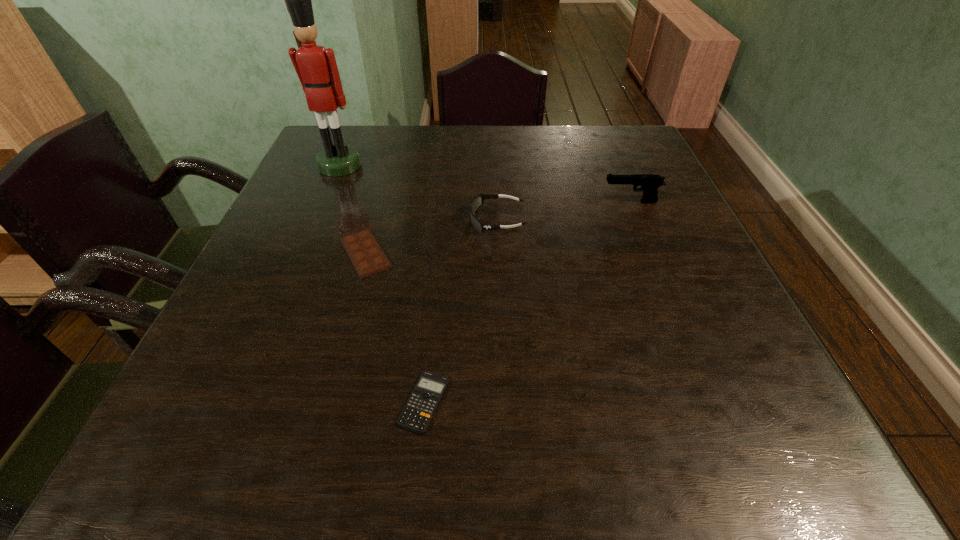
At what (x,y) coordinates should I click in order to perform the action: click on vacant space in between the farthest object and the chocolate bar. Please return your answer as a coordinate pair (x, y). Image resolution: width=960 pixels, height=540 pixels. Looking at the image, I should click on (352, 210).

This screenshot has width=960, height=540. Find the location of `free space between the fourth object from left to right and the fourth object from right to left`. free space between the fourth object from left to right and the fourth object from right to left is located at coordinates (431, 237).

You are a GUI agent. You are given a task and a screenshot of the screen. Output one action in this format:
    pyautogui.click(x=<x>, y=<y>)
    Task: Click on the free area in between the third shortest object and the chocolate bar
    The height and width of the screenshot is (540, 960).
    Given the screenshot: What is the action you would take?
    pyautogui.click(x=431, y=237)

Locate an element on the screen. This screenshot has height=540, width=960. unoccupied position between the chocolate bar and the tallest object is located at coordinates (352, 210).

At what (x,y) coordinates should I click in order to perform the action: click on free space between the farthest object and the second object from right to left. Please return your answer as a coordinate pair (x, y). Looking at the image, I should click on (419, 193).

The image size is (960, 540). In order to click on free space that is in between the goggles and the calculator in this screenshot , I will do `click(460, 311)`.

Identify the location of free point between the pistol and the leftmost object. (486, 184).

Select which object is the fourth closest to the third object from right to left. Please provide its 2D coordinates. Your answer should be formatted as a tuple, i.e. [(x, y)], where the tuple contains the x and y coordinates of a point satisfying the conditions above.

[(316, 67)]

Point out which object is positioned as the third nearest to the rightmost object. Please provide its 2D coordinates. Your answer should be formatted as a tuple, i.e. [(x, y)], where the tuple contains the x and y coordinates of a point satisfying the conditions above.

[(418, 411)]

At what (x,y) coordinates should I click in order to perform the action: click on vacant space that satisfies the following two spatial constraints: 1. on the front-facing side of the chocolate bar; 2. on the right side of the nutcracker. Please return your answer as a coordinate pair (x, y). Looking at the image, I should click on (302, 253).